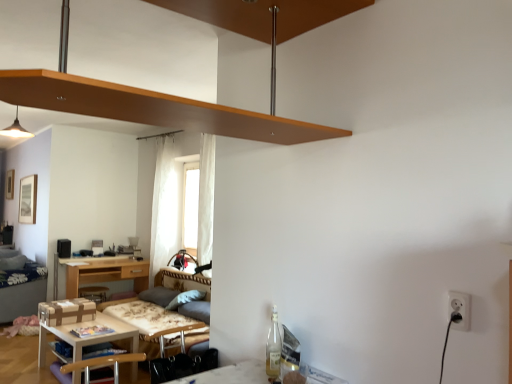
This screenshot has height=384, width=512. Describe the element at coordinates (163, 206) in the screenshot. I see `white sheer curtain at center` at that location.

Image resolution: width=512 pixels, height=384 pixels. Describe the element at coordinates (104, 272) in the screenshot. I see `light brown wooden desk at center` at that location.

Find the location of a particular element. soft gray fabric pillow at lower center is located at coordinates (185, 298).

Where is `wooden table at lower left`? This screenshot has width=512, height=384. wooden table at lower left is located at coordinates (88, 337).

What do you see at coordinates (20, 285) in the screenshot? The width and height of the screenshot is (512, 384). I see `dark blue fabric bed at left` at bounding box center [20, 285].

In the scene shown: What is the approximate width of brown wooden shelf at upper center?

The width of brown wooden shelf at upper center is 3.90 feet.

The image size is (512, 384). I want to click on white sheer curtain at center, so click(x=163, y=206).

From the picture: From a real-world perspective, which is physically above, white sheer curtain at center or wooden table at lower left?

In real-world perspective, white sheer curtain at center is above.

Considering the positions of objects white sheer curtain at center and wooden table at lower left in the image provided, who is more to the left, white sheer curtain at center or wooden table at lower left?

wooden table at lower left is more to the left.

Considering the relative sizes of white sheer curtain at center and wooden table at lower left in the image provided, is white sheer curtain at center bigger than wooden table at lower left?

Correct, white sheer curtain at center is larger in size than wooden table at lower left.

Consider the image. Does white sheer curtain at center come in front of wooden table at lower left?

No, the depth of white sheer curtain at center is greater than that of wooden table at lower left.

Considering the sizes of brown wooden shelf at upper center and light brown wooden desk at center in the image, is brown wooden shelf at upper center taller or shorter than light brown wooden desk at center?

brown wooden shelf at upper center is taller than light brown wooden desk at center.

Can you confirm if brown wooden shelf at upper center is positioned to the left of light brown wooden desk at center?

No.

Is brown wooden shelf at upper center inside or outside of light brown wooden desk at center?

The correct answer is: outside.

From a real-world perspective, is brown wooden shelf at upper center positioned above or below light brown wooden desk at center?

In terms of real-world spatial position, brown wooden shelf at upper center is above light brown wooden desk at center.

This screenshot has height=384, width=512. In order to click on light fixture on the left of the wooden table at lower left in this screenshot , I will do `click(16, 130)`.

Considering the relative sizes of matte white pendant light at upper left and wooden table at lower left in the image provided, is matte white pendant light at upper left wider than wooden table at lower left?

No, matte white pendant light at upper left is not wider than wooden table at lower left.

Are matte white pendant light at upper left and wooden table at lower left making contact?

No.

Is matte white pendant light at upper left outside of wooden table at lower left?

matte white pendant light at upper left lies outside wooden table at lower left's area.

From the picture: Who is bigger, brown wooden shelf at upper center or white sheer curtain at center?

brown wooden shelf at upper center is bigger.

Is brown wooden shelf at upper center at the left side of white sheer curtain at center?

No.

Is brown wooden shelf at upper center far from white sheer curtain at center?

Absolutely, brown wooden shelf at upper center is distant from white sheer curtain at center.

In order to click on exhaust hood in front of the white sheer curtain at center in this screenshot , I will do `click(151, 107)`.

Based on the photo, is wooden table at lower left facing away from brown wooden shelf at upper center?

wooden table at lower left does not have its back to brown wooden shelf at upper center.

Which object is more forward, wooden table at lower left or brown wooden shelf at upper center?

brown wooden shelf at upper center.

Consider the image. Based on their sizes in the image, would you say wooden table at lower left is bigger or smaller than brown wooden shelf at upper center?

In the image, wooden table at lower left appears to be smaller than brown wooden shelf at upper center.

Based on the photo, from the image's perspective, would you say wooden table at lower left is shown under brown wooden shelf at upper center?

Yes.

From a real-world perspective, which object rests below the other?

velvet grey couch at lower left, from a real-world perspective.

Which point is more distant from viewer, (172, 286) or (19, 307)?

Positioned behind is point (19, 307).

Based on the photo, how different are the orientations of velvet grey couch at lower left and dark blue fabric bed at left in degrees?

The angular difference between velvet grey couch at lower left and dark blue fabric bed at left is 2.85 degrees.

Is velvet grey couch at lower left positioned beyond the bounds of dark blue fabric bed at left?

Indeed, velvet grey couch at lower left is completely outside dark blue fabric bed at left.

Is matte white pendant light at upper left looking in the opposite direction of brown wooden shelf at upper center?

No, matte white pendant light at upper left is not facing away from brown wooden shelf at upper center.

The height and width of the screenshot is (384, 512). What are the coordinates of `exhaust hood in front of the matte white pendant light at upper left` in the screenshot? It's located at (151, 107).

Where is `table lying below the white sheer curtain at center (from the image's perspective)`? table lying below the white sheer curtain at center (from the image's perspective) is located at coordinates (88, 337).

This screenshot has height=384, width=512. In order to click on exhaust hood above the light brown wooden desk at center (from a real-world perspective) in this screenshot , I will do `click(151, 107)`.

Looking at the image, which one is located closer to wooden table at lower left, soft gray fabric pillow at lower center or white plastic electric outlet at lower right?

soft gray fabric pillow at lower center is positioned closer to the anchor wooden table at lower left.

Which object lies nearer to the anchor point wooden table at lower left, soft gray fabric pillow at lower center or dark blue fabric bed at left?

soft gray fabric pillow at lower center is closer to wooden table at lower left.

Which object lies nearer to the anchor point white plastic electric outlet at lower right, brown wooden shelf at upper center or matte white pendant light at upper left?

Among the two, brown wooden shelf at upper center is located nearer to white plastic electric outlet at lower right.

From the image, which object appears to be farther from wooden table at lower left, light brown wooden desk at center or dark blue fabric bed at left?

The object further to wooden table at lower left is dark blue fabric bed at left.

Considering their positions, is white sheer curtain at center positioned further to soft gray fabric pillow at lower center than matte white pendant light at upper left?

matte white pendant light at upper left lies further to soft gray fabric pillow at lower center than the other object.

Which object lies further to the anchor point brown wooden shelf at upper center, wooden table at lower left or matte white pendant light at upper left?

matte white pendant light at upper left is further to brown wooden shelf at upper center.

Which object lies further to the anchor point soft gray fabric pillow at lower center, matte white pendant light at upper left or dark blue fabric bed at left?

matte white pendant light at upper left is further to soft gray fabric pillow at lower center.

Which object lies nearer to the anchor point wooden table at lower left, brown wooden shelf at upper center or dark blue fabric bed at left?

dark blue fabric bed at left is positioned closer to the anchor wooden table at lower left.

Locate an element on the screen. This screenshot has height=384, width=512. couch between matte white pendant light at upper left and wooden table at lower left in the up-down direction is located at coordinates (158, 323).

You are a GUI agent. You are given a task and a screenshot of the screen. Output one action in this format:
    pyautogui.click(x=<x>, y=<y>)
    Task: Click on the pillow between white plastic electric outlet at lower right and white sheer curtain at center along the z-axis
    
    Given the screenshot: What is the action you would take?
    pyautogui.click(x=185, y=298)

Locate an element on the screen. Image resolution: width=512 pixels, height=384 pixels. electric outlet located between brown wooden shelf at upper center and light brown wooden desk at center in the depth direction is located at coordinates (460, 309).

Where is `table between matte white pendant light at upper left and white plastic electric outlet at lower right from left to right`? Image resolution: width=512 pixels, height=384 pixels. table between matte white pendant light at upper left and white plastic electric outlet at lower right from left to right is located at coordinates (88, 337).